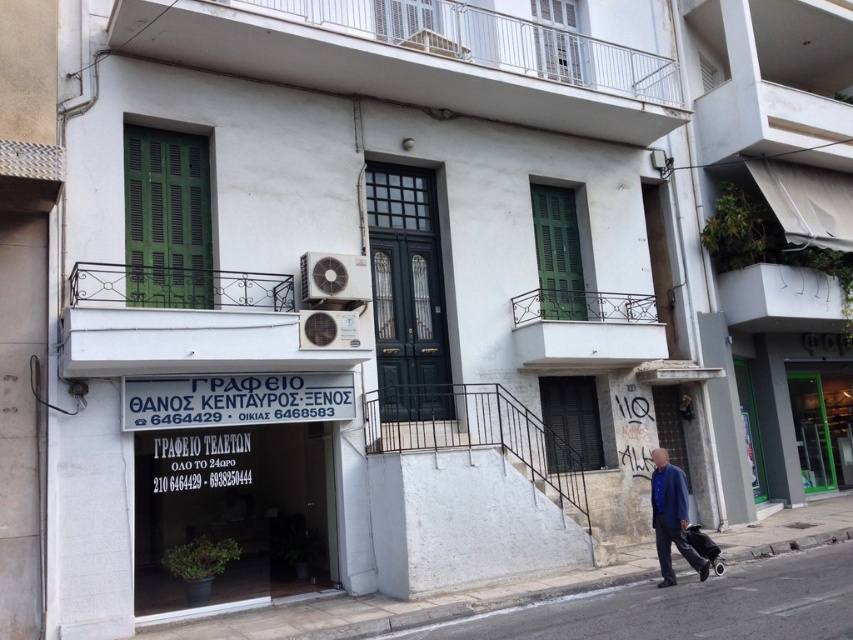
Question: In this image, where is gray concrete pavement at lower center located relative to blue denim jacket at lower right?

Choices:
 (A) right
 (B) left

Answer: (B)

Question: Which of the following is the closest to the observer?

Choices:
 (A) gray concrete pavement at lower center
 (B) blue denim jacket at lower right

Answer: (A)

Question: Which object appears closest to the camera in this image?

Choices:
 (A) blue denim jacket at lower right
 (B) gray concrete pavement at lower center

Answer: (B)

Question: Does gray concrete pavement at lower center have a larger size compared to blue denim jacket at lower right?

Choices:
 (A) yes
 (B) no

Answer: (A)

Question: Does gray concrete pavement at lower center appear under blue denim jacket at lower right?

Choices:
 (A) yes
 (B) no

Answer: (A)

Question: Which of the following is the farthest from the observer?

Choices:
 (A) blue denim jacket at lower right
 (B) gray concrete pavement at lower center

Answer: (A)